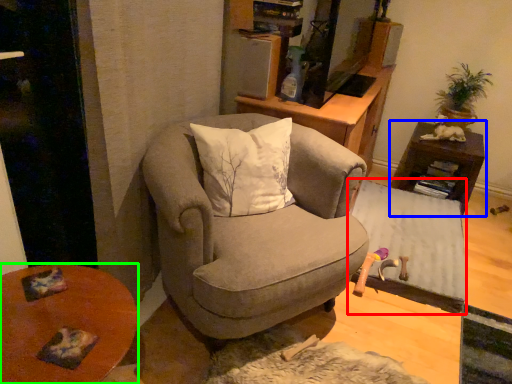
Question: Considering the real-world distances, which object is closest to table (highlighted by a red box)? table (highlighted by a blue box) or desk (highlighted by a green box).

Choices:
 (A) table
 (B) desk

Answer: (A)